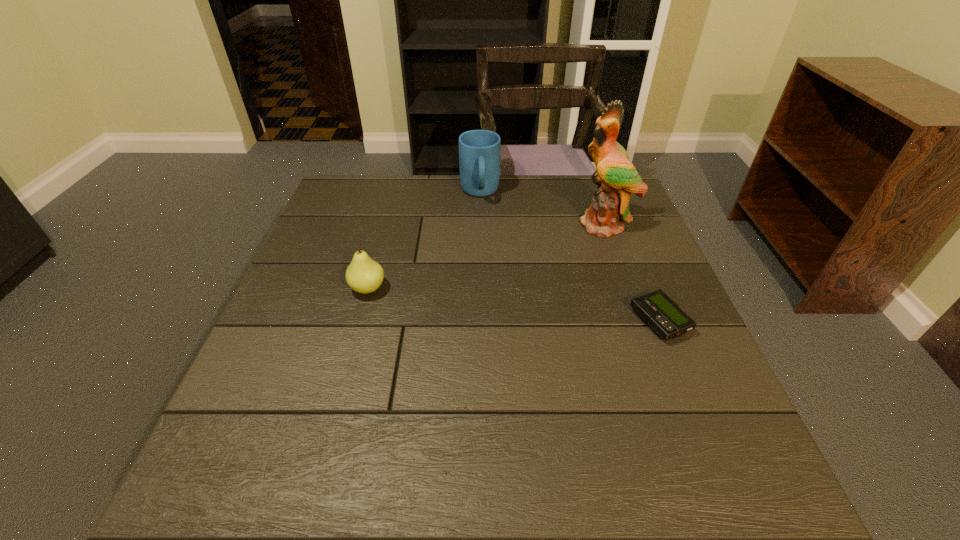
You are a GUI agent. You are given a task and a screenshot of the screen. Output one action in this format:
    pyautogui.click(x=<x>, y=<y>)
    Task: Click on the pear
    
    Given the screenshot: What is the action you would take?
    pyautogui.click(x=364, y=275)

This screenshot has width=960, height=540. What are the coordinates of `the third tallest object` in the screenshot? It's located at (364, 275).

I want to click on the shortest object, so click(x=658, y=310).

You are a GUI agent. You are given a task and a screenshot of the screen. Output one action in this format:
    pyautogui.click(x=<x>, y=<y>)
    Task: Click on the farthest object
    This screenshot has width=960, height=540.
    Given the screenshot: What is the action you would take?
    pyautogui.click(x=479, y=150)

Where is `mug`? mug is located at coordinates (479, 150).

Where is `the second farthest object`? the second farthest object is located at coordinates (616, 177).

This screenshot has width=960, height=540. In order to click on parrot in this screenshot , I will do `click(616, 177)`.

The height and width of the screenshot is (540, 960). In order to click on vacant region located on the right of the pear in this screenshot , I will do `click(466, 288)`.

The image size is (960, 540). What are the coordinates of `vacant area located 0.300m on the left of the shortest object` in the screenshot? It's located at (496, 321).

This screenshot has width=960, height=540. I want to click on vacant space located 0.100m on the side of the second object from left to right with the handle, so click(x=484, y=228).